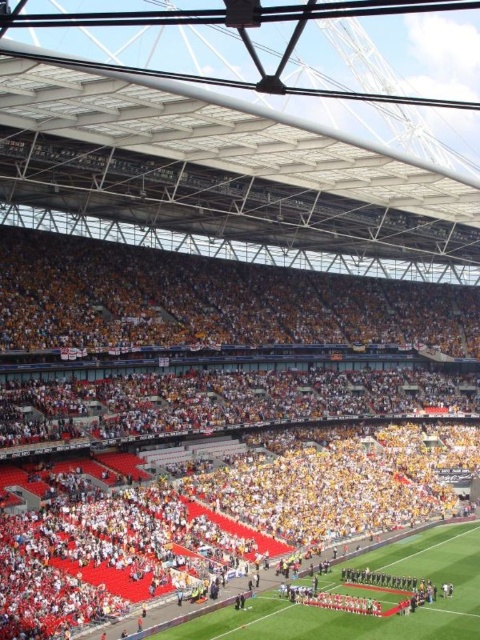
Does point (63, 593) lie in front of point (160, 636)?

No, (63, 593) is further to viewer.

Between point (279, 429) and point (456, 556), which one is positioned in front?

Point (456, 556)

Which is in front, point (207, 432) or point (377, 637)?

Point (377, 637) is in front.

Locate an element on the screen. yellow fabric seats at center is located at coordinates (216, 465).